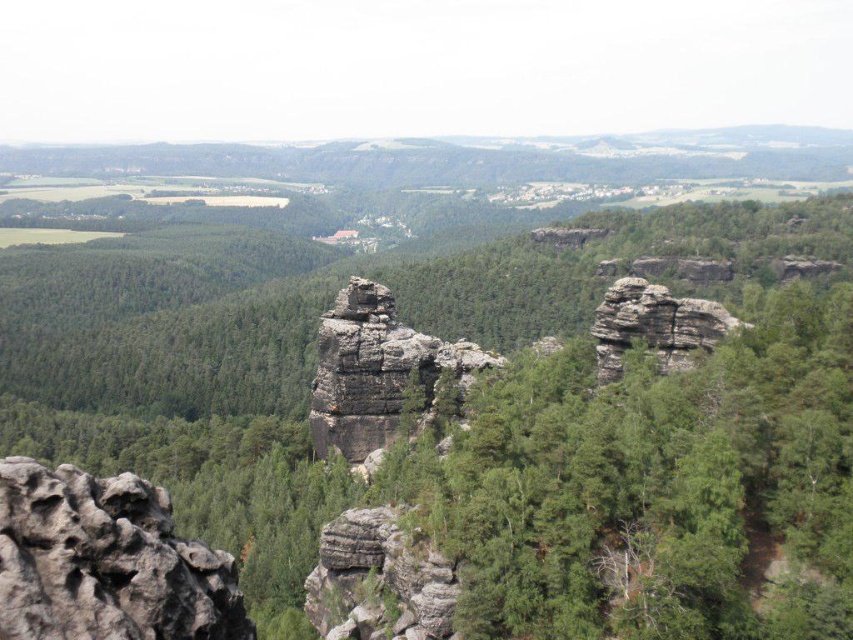
Measure the distance between green rough rock at center and rugged stone rock formation at center.

A distance of 32.44 meters exists between green rough rock at center and rugged stone rock formation at center.

Is green rough rock at center positioned before rugged stone rock formation at center?

Yes, it is.

Between point (97, 467) and point (347, 349), which one is positioned behind?

The point (97, 467) is behind.

What are the coordinates of `green rough rock at center` in the screenshot? It's located at (515, 428).

Which is above, green rough rock at center or rugged stone rock at center?

rugged stone rock at center

Locate an element on the screen. The width and height of the screenshot is (853, 640). green rough rock at center is located at coordinates [x=515, y=428].

Between point (88, 573) and point (705, 346), which one is positioned behind?

The point (705, 346) is more distant.

Between point (206, 563) and point (628, 321), which one is positioned behind?

The point (628, 321) is more distant.

You are a GUI agent. You are given a task and a screenshot of the screen. Output one action in this format:
    pyautogui.click(x=<x>, y=<y>)
    Task: Click on the rough stone rock at lower left
    The width and height of the screenshot is (853, 640).
    Given the screenshot: What is the action you would take?
    pos(105,561)